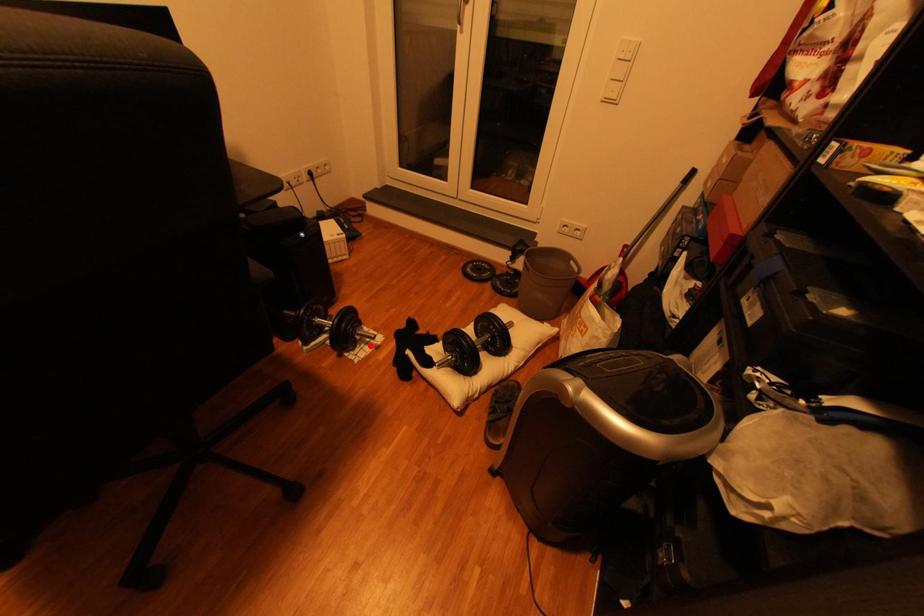
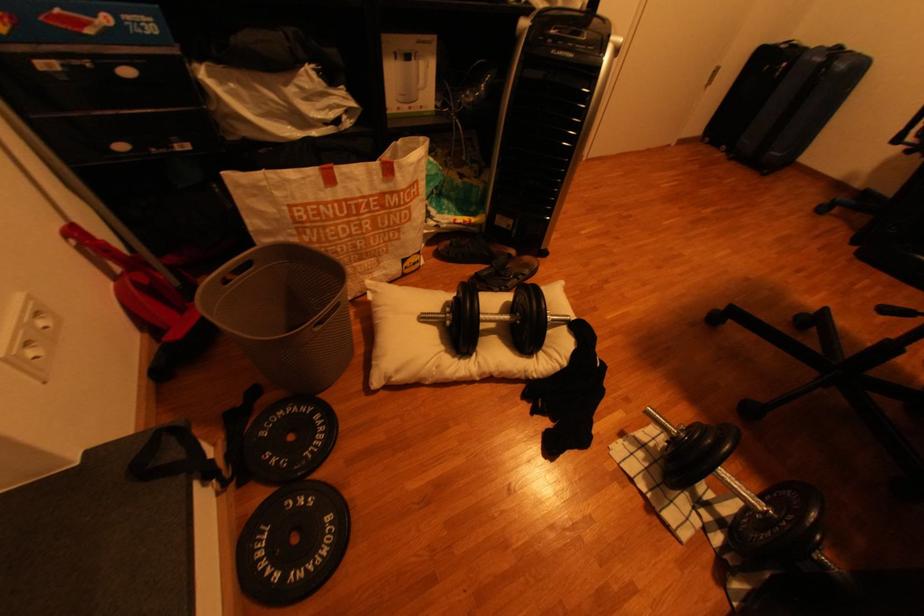
Question: I am providing you with two images of the same scene from different viewpoints. Image1 has a red point marked. In image2, the corresponding 3D location appears at what relative position? Reply with the corresponding letter.

Choices:
 (A) Closer
 (B) Farther

Answer: (B)